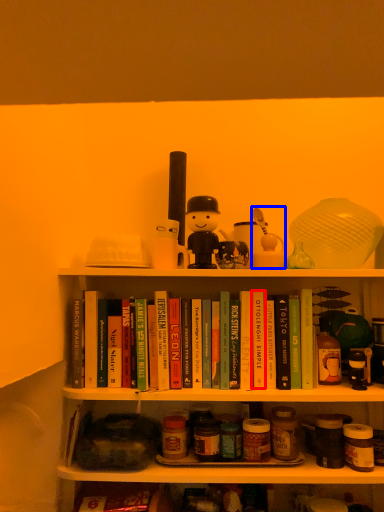
Question: Which object is further to the camera taking this photo, paperback book (highlighted by a red box) or toy (highlighted by a blue box)?

Choices:
 (A) paperback book
 (B) toy

Answer: (B)